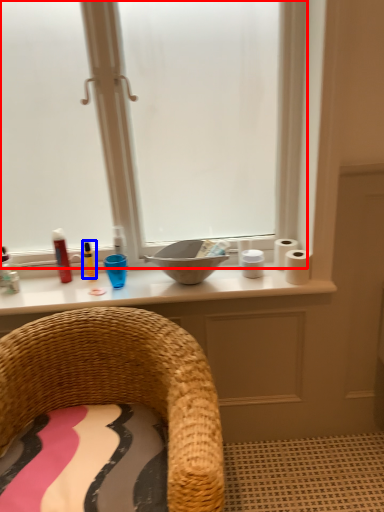
Question: Which object appears closest to the camera in this image, window (highlighted by a red box) or toiletry (highlighted by a blue box)?

Choices:
 (A) window
 (B) toiletry

Answer: (A)